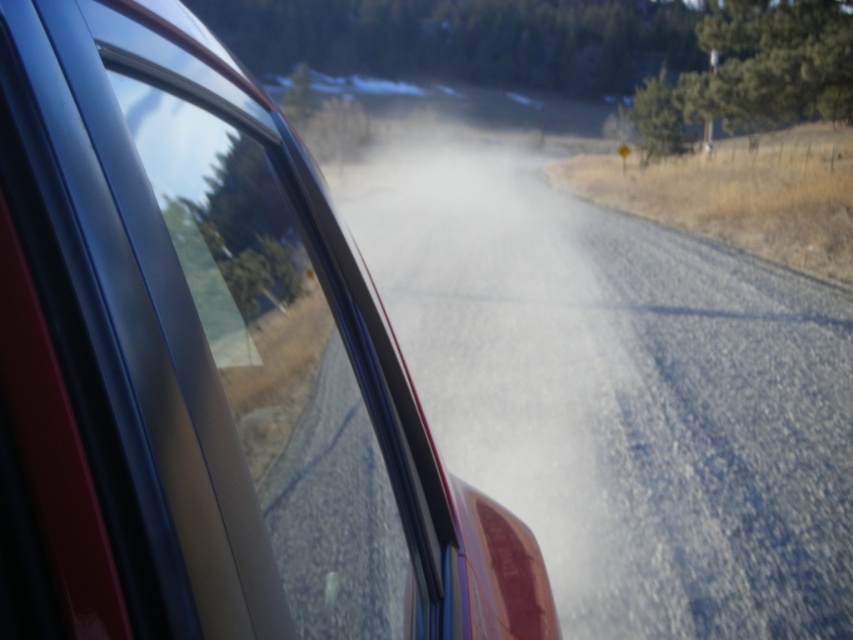
Question: Does glossy metallic car at center lie behind white powdery dust at center?

Choices:
 (A) no
 (B) yes

Answer: (A)

Question: Can you confirm if glossy metallic car at center is bigger than white powdery dust at center?

Choices:
 (A) no
 (B) yes

Answer: (A)

Question: Does glossy metallic car at center appear over white powdery dust at center?

Choices:
 (A) no
 (B) yes

Answer: (A)